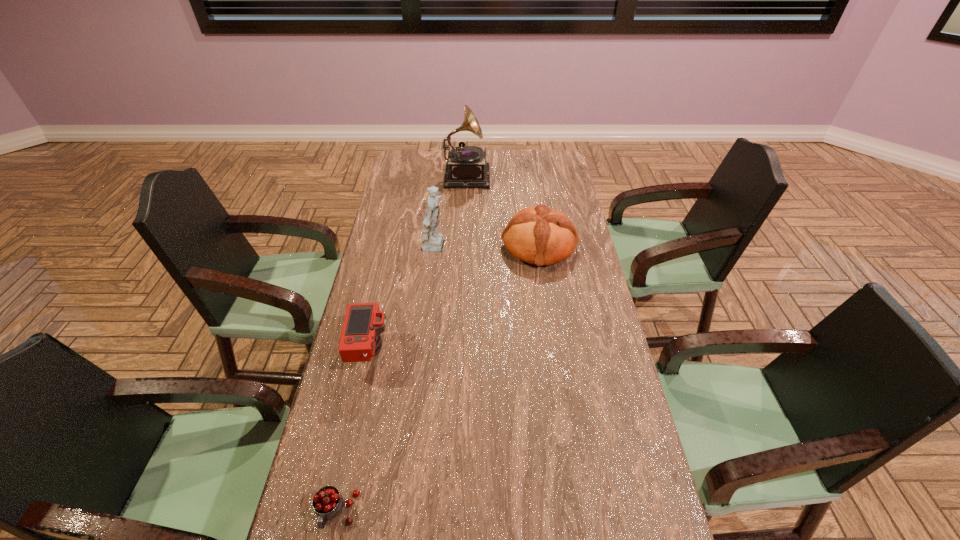
Where is `record player`? The image size is (960, 540). record player is located at coordinates (466, 167).

I want to click on the farthest object, so click(x=466, y=167).

The image size is (960, 540). I want to click on figurine, so click(x=431, y=240).

Image resolution: width=960 pixels, height=540 pixels. I want to click on the rightmost object, so click(538, 235).

Locate an element on the screen. The image size is (960, 540). the fourth farthest object is located at coordinates (360, 340).

You are a GUI agent. You are given a task and a screenshot of the screen. Output one action in this format:
    pyautogui.click(x=<x>, y=<y>)
    Task: Click on the nearest object
    This screenshot has width=960, height=540.
    Given the screenshot: What is the action you would take?
    pyautogui.click(x=327, y=502)

This screenshot has height=540, width=960. Identify the location of cherry. (327, 502).

Locate an element on the screen. The height and width of the screenshot is (540, 960). vacant region located 0.140m on the horn of the tallest object is located at coordinates (519, 174).

Find the location of `free spot located on the front-facing side of the second tallest object`. free spot located on the front-facing side of the second tallest object is located at coordinates (532, 248).

You are a GUI agent. You are given a task and a screenshot of the screen. Output one action in this format:
    pyautogui.click(x=<x>, y=<y>)
    Task: Click on the free location located on the left of the bread
    This screenshot has width=960, height=540.
    Given the screenshot: What is the action you would take?
    pyautogui.click(x=446, y=246)